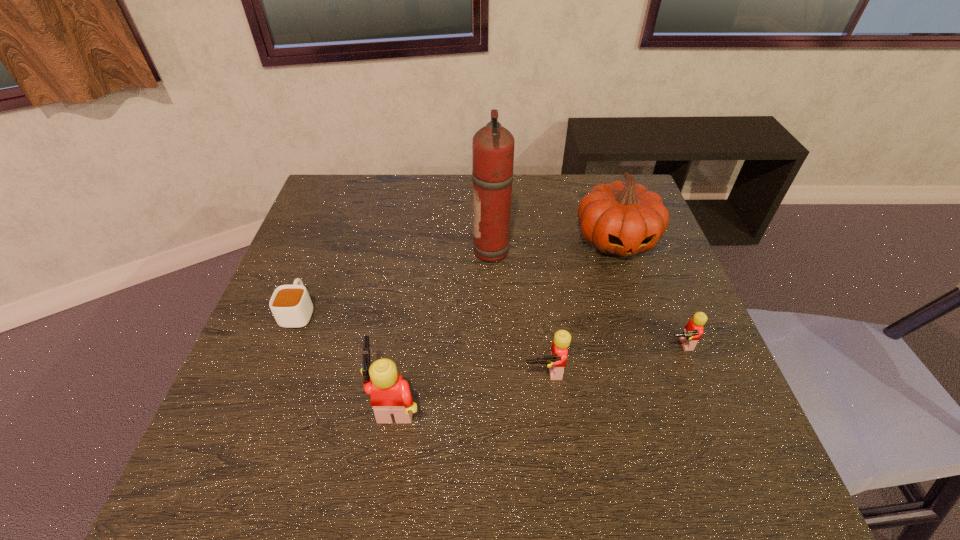
The image size is (960, 540). In order to click on vacant space located 0.240m in front of the tallest Lego with the accessory visible in this screenshot , I will do `click(248, 401)`.

What are the coordinates of `vacant space located 0.280m in front of the tallest Lego with the accessory visible` in the screenshot? It's located at (228, 401).

Locate an element on the screen. This screenshot has width=960, height=540. vacant space positioned 0.190m in front of the tallest Lego with the accessory visible is located at coordinates (273, 401).

You are a GUI agent. You are given a task and a screenshot of the screen. Output one action in this format:
    pyautogui.click(x=<x>, y=<y>)
    Task: Click on the free space located in front of the second Lego from left to right with the accessory visible
    This screenshot has width=960, height=540.
    Given the screenshot: What is the action you would take?
    pyautogui.click(x=552, y=435)

Identify the location of free space located in front of the shortest Lego with the accessory visible. (705, 411).

You are a GUI agent. You are given a task and a screenshot of the screen. Output one action in this format:
    pyautogui.click(x=<x>, y=<y>)
    Task: Click on the free space located on the face of the pumpkin
    Image resolution: width=960 pixels, height=540 pixels.
    Given the screenshot: What is the action you would take?
    pyautogui.click(x=630, y=282)

At what (x,y) coordinates should I click in order to perform the action: click on vacant space located 0.110m on the side of the fire extinguisher with the label and nozzle. Please return your answer as a coordinate pair (x, y). Looking at the image, I should click on (432, 252).

Identify the location of vacant space located on the side of the fire extinguisher with the label and nozzle. (418, 252).

At what (x,y) coordinates should I click in order to perform the action: click on free space located on the side of the fire extinguisher with the label and nozzle. Please return your answer as a coordinate pair (x, y). The height and width of the screenshot is (540, 960). Looking at the image, I should click on (328, 252).

Image resolution: width=960 pixels, height=540 pixels. I want to click on vacant space located 0.320m on the side with the handle of the cup, so click(x=336, y=214).